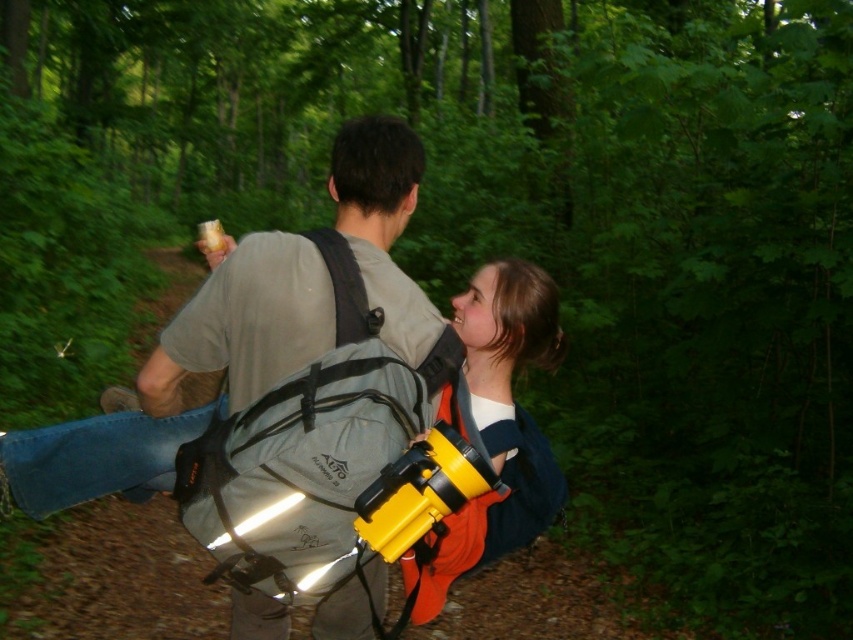
In the scene shown: Who is higher up, yellow matte camera at center or black fabric strap at upper center?

Positioned higher is black fabric strap at upper center.

The image size is (853, 640). I want to click on yellow matte camera at center, so click(x=321, y=408).

Where is `yellow matte camera at center`? yellow matte camera at center is located at coordinates (321, 408).

You are a GUI agent. You are given a task and a screenshot of the screen. Output one action in this format:
    pyautogui.click(x=<x>, y=<y>)
    Task: Click on the yellow matte camera at center
    This screenshot has height=640, width=853.
    Given the screenshot: What is the action you would take?
    pyautogui.click(x=321, y=408)

How much distance is there between yellow plastic camera at center and black fabric strap at upper center?

A distance of 39.68 centimeters exists between yellow plastic camera at center and black fabric strap at upper center.

Is point (523, 436) positioned before point (364, 296)?

No, (523, 436) is behind (364, 296).

Locate an element on the screen. The image size is (853, 640). yellow plastic camera at center is located at coordinates (498, 426).

From the picture: Who is lower down, yellow matte camera at center or yellow plastic camera at center?

yellow plastic camera at center is lower down.

Is yellow matte camera at center further to the viewer compared to yellow plastic camera at center?

No, it is in front of yellow plastic camera at center.

Measure the distance between yellow matte camera at center and camera.

They are 5.08 feet apart.

You are a GUI agent. You are given a task and a screenshot of the screen. Output one action in this format:
    pyautogui.click(x=<x>, y=<y>)
    Task: Click on the yellow matte camera at center
    The height and width of the screenshot is (640, 853).
    Given the screenshot: What is the action you would take?
    pyautogui.click(x=321, y=408)